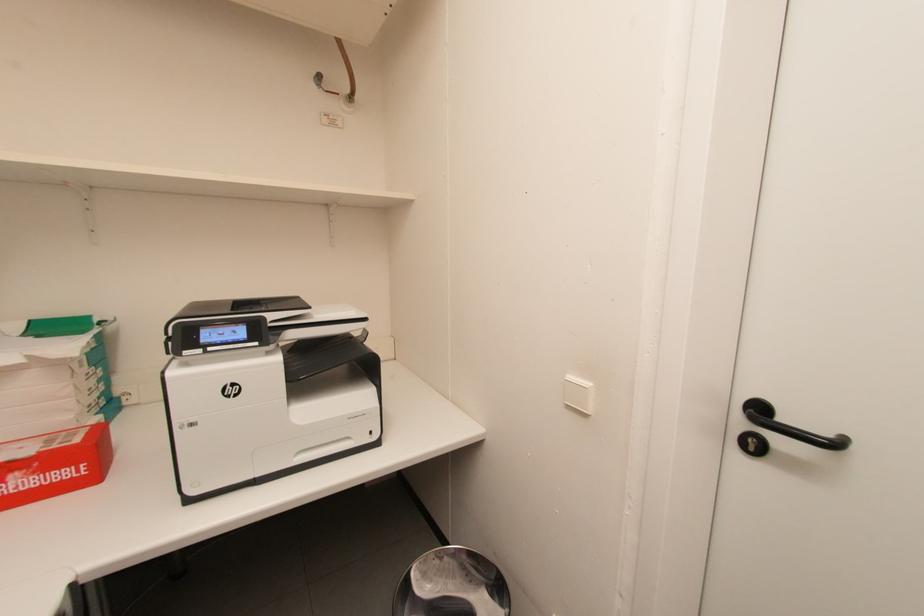
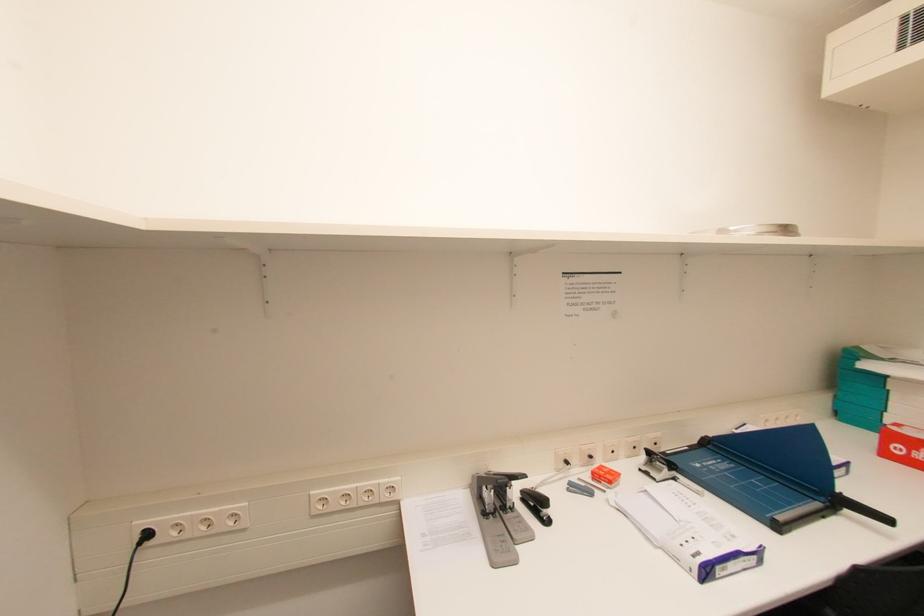
Question: Based on the continuous images, in which direction is the camera rotating? Reply with the corresponding letter.

Choices:
 (A) Left
 (B) Right
 (C) Up
 (D) Down

Answer: (A)